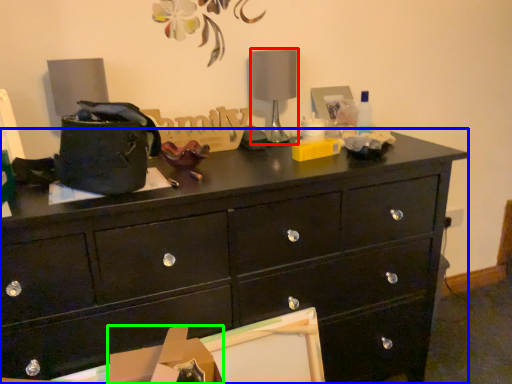
Question: Considering the real-world distances, which object is farthest from table lamp (highlighted by a red box)? chest of drawers (highlighted by a blue box) or cardboard box (highlighted by a green box)?

Choices:
 (A) chest of drawers
 (B) cardboard box

Answer: (B)